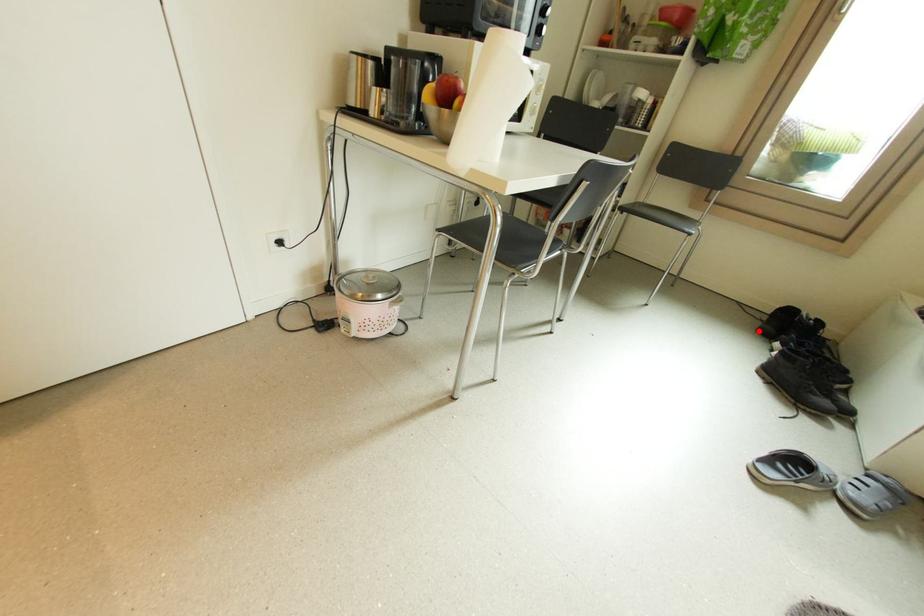
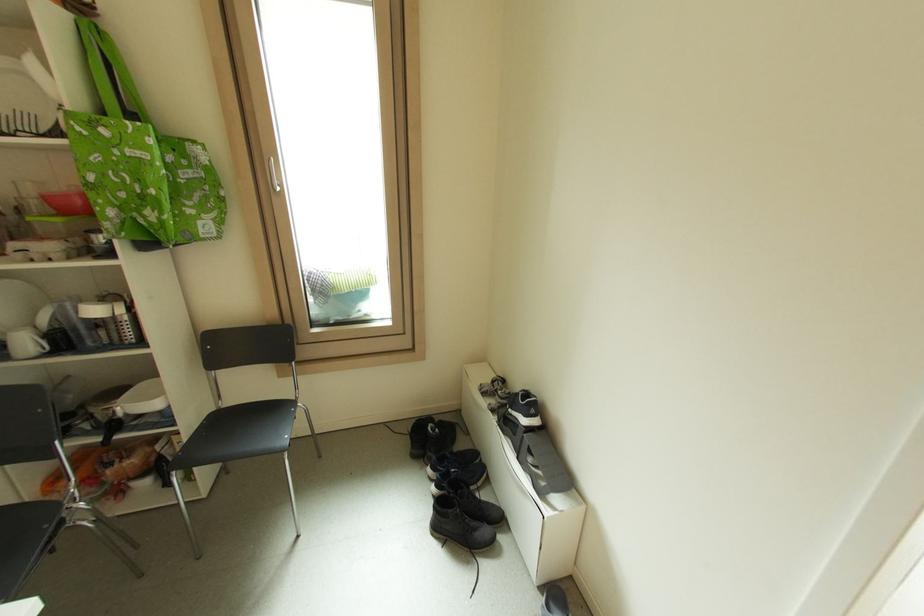
Question: I am providing you with two images of the same scene from different viewpoints. In image1, a red point is highlighted. Considering the same 3D point in image2, which of the following is correct?

Choices:
 (A) It is closer
 (B) It is farther

Answer: (B)